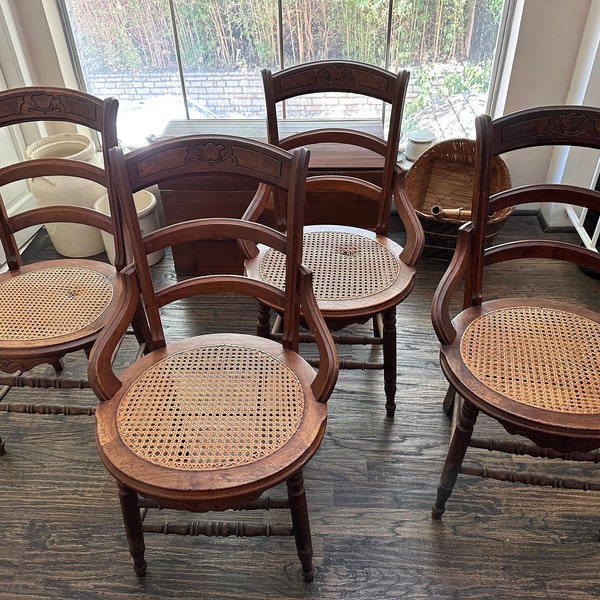
Where is `seat of chair`? This screenshot has height=600, width=600. seat of chair is located at coordinates (200, 405), (60, 310), (358, 260), (539, 357).